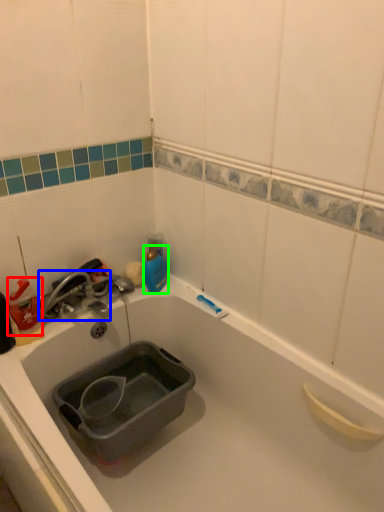
Question: Which object is positioned farthest from cleaning product (highlighted by a red box)? Select from tap (highlighted by a blue box) and bottle (highlighted by a green box).

Choices:
 (A) tap
 (B) bottle

Answer: (B)